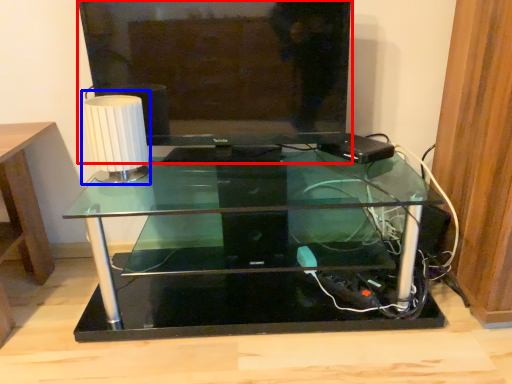
Question: Which point is closer to the camera, television (highlighted by a red box) or table lamp (highlighted by a blue box)?

Choices:
 (A) television
 (B) table lamp

Answer: (A)